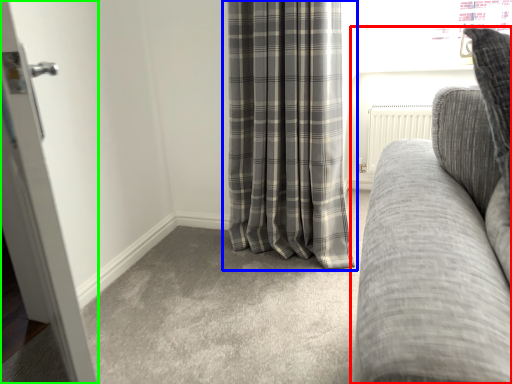
Question: Estimate the real-world distances between objects in this image. Which object is closer to studio couch (highlighted by a red box), curtain (highlighted by a blue box) or door (highlighted by a green box)?

Choices:
 (A) curtain
 (B) door

Answer: (B)